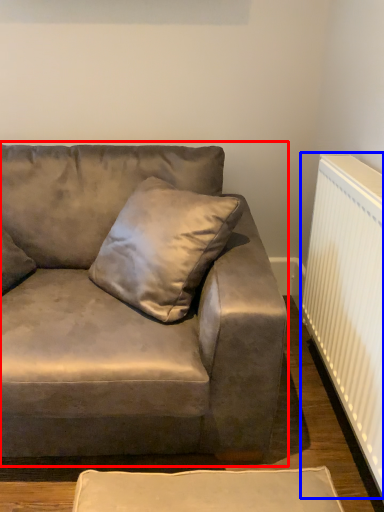
Question: Which point is further to the camera, studio couch (highlighted by a red box) or radiator (highlighted by a blue box)?

Choices:
 (A) studio couch
 (B) radiator

Answer: (B)